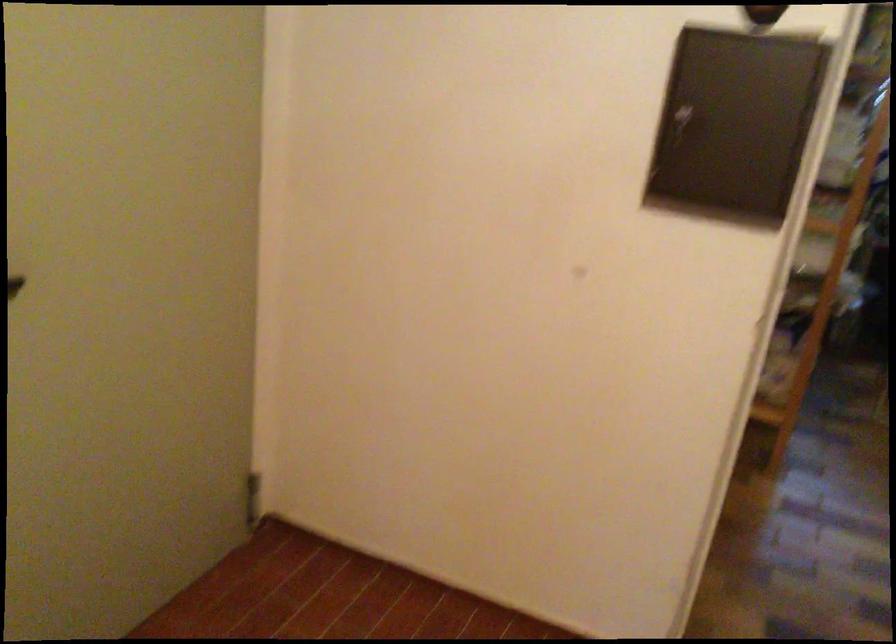
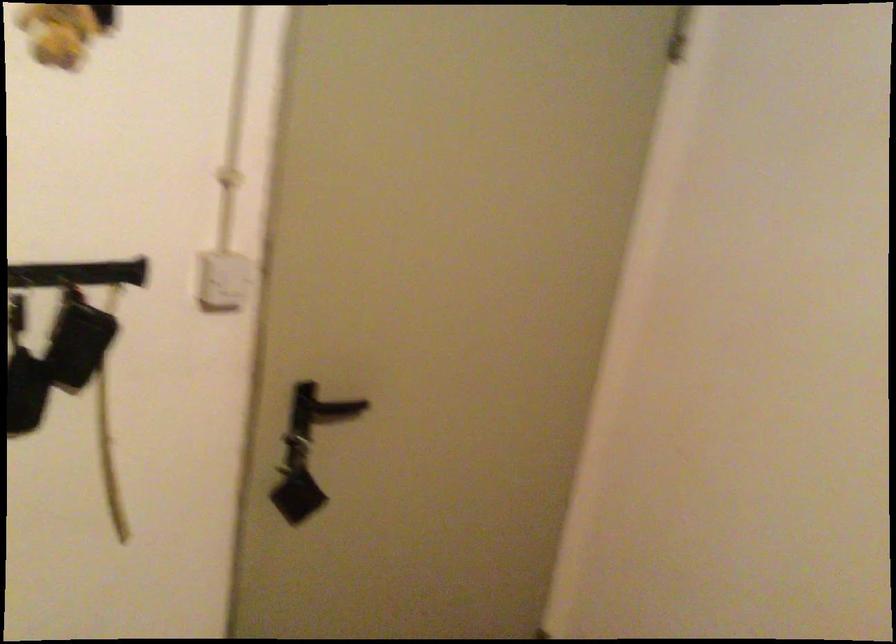
Question: The first image is from the beginning of the video and the second image is from the end. How did the camera likely rotate when shooting the video?

Choices:
 (A) Left
 (B) Right
 (C) Up
 (D) Down

Answer: (A)